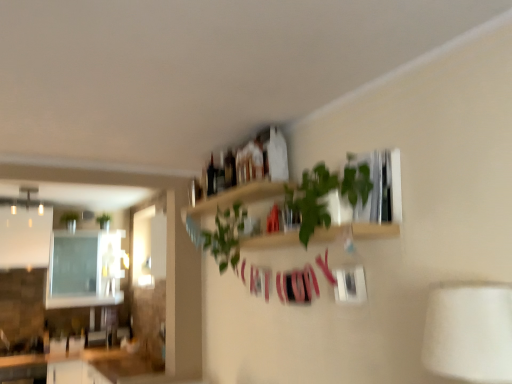
Question: Considering the relative sizes of white glossy countertop at lower left and green matte plant at upper left, which appears as the 1th plant when viewed from the back, in the image provided, is white glossy countertop at lower left bigger than green matte plant at upper left, which appears as the 1th plant when viewed from the back,?

Choices:
 (A) no
 (B) yes

Answer: (B)

Question: Would you say green matte plant at upper left, placed as the second plant when sorted from front to back, is part of white glossy countertop at lower left's contents?

Choices:
 (A) yes
 (B) no

Answer: (B)

Question: Can you confirm if white glossy countertop at lower left is positioned to the right of green matte plant at upper left, placed as the second plant when sorted from front to back?

Choices:
 (A) no
 (B) yes

Answer: (B)

Question: Is white glossy countertop at lower left wider than green matte plant at upper left, the second plant in the right-to-left sequence?

Choices:
 (A) yes
 (B) no

Answer: (A)

Question: Can you confirm if white glossy countertop at lower left is positioned to the left of green matte plant at upper left, the second plant in the right-to-left sequence?

Choices:
 (A) no
 (B) yes

Answer: (A)

Question: Is white glossy countertop at lower left thinner than green matte plant at upper left, which appears as the 1th plant when viewed from the back?

Choices:
 (A) no
 (B) yes

Answer: (A)

Question: Does matte black bottle at upper center, placed as the first bottle when sorted from front to back, have a greater height compared to green matte plant at upper left, which appears as the 1th plant when viewed from the left?

Choices:
 (A) no
 (B) yes

Answer: (A)

Question: Can you confirm if matte black bottle at upper center, placed as the first bottle when sorted from front to back, is positioned to the right of green matte plant at upper left, the second plant in the right-to-left sequence?

Choices:
 (A) yes
 (B) no

Answer: (A)

Question: From a real-world perspective, is matte black bottle at upper center, placed as the first bottle when sorted from front to back, below green matte plant at upper left, which appears as the 1th plant when viewed from the back?

Choices:
 (A) yes
 (B) no

Answer: (A)

Question: Considering the relative positions of matte black bottle at upper center, which appears as the 2th bottle when viewed from the left, and green matte plant at upper left, which appears as the 1th plant when viewed from the back, in the image provided, is matte black bottle at upper center, which appears as the 2th bottle when viewed from the left, in front of green matte plant at upper left, which appears as the 1th plant when viewed from the back,?

Choices:
 (A) no
 (B) yes

Answer: (B)

Question: Is matte black bottle at upper center, which appears as the 2th bottle when viewed from the left, oriented towards green matte plant at upper left, placed as the second plant when sorted from front to back?

Choices:
 (A) yes
 (B) no

Answer: (B)

Question: Is matte black bottle at upper center, placed as the first bottle when sorted from front to back, next to green matte plant at upper left, which appears as the 1th plant when viewed from the left, and touching it?

Choices:
 (A) yes
 (B) no

Answer: (B)

Question: Is there a large distance between white fabric lampshade at lower right and green matte plant at upper left, which appears as the 1th plant when viewed from the left?

Choices:
 (A) no
 (B) yes

Answer: (B)